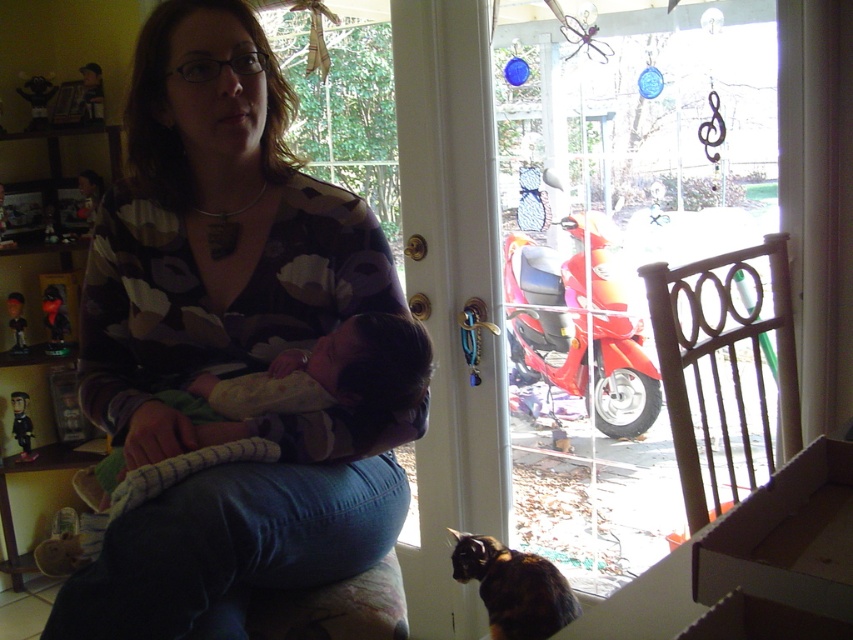
Is soft yellow fabric at center smaller than calico fur cat at lower center?

Incorrect, soft yellow fabric at center is not smaller in size than calico fur cat at lower center.

Can you confirm if soft yellow fabric at center is wider than calico fur cat at lower center?

Indeed, soft yellow fabric at center has a greater width compared to calico fur cat at lower center.

Describe the element at coordinates (312, 385) in the screenshot. I see `soft yellow fabric at center` at that location.

This screenshot has width=853, height=640. I want to click on soft yellow fabric at center, so click(x=312, y=385).

Does matte floral shirt at center have a smaller size compared to white cardboard box at lower right?

Actually, matte floral shirt at center might be larger than white cardboard box at lower right.

Is point (154, 371) more distant than point (850, 508)?

Yes, point (154, 371) is farther from viewer.

Is point (276, 337) positioned before point (778, 544)?

That is False.

Find the location of a particular element. The image size is (853, 640). matte floral shirt at center is located at coordinates (212, 230).

Between white cardboard box at lower right and calico fur cat at lower center, which one is positioned higher?

white cardboard box at lower right

Is point (836, 600) positioned after point (463, 557)?

No, it is not.

Image resolution: width=853 pixels, height=640 pixels. I want to click on white cardboard box at lower right, so click(787, 538).